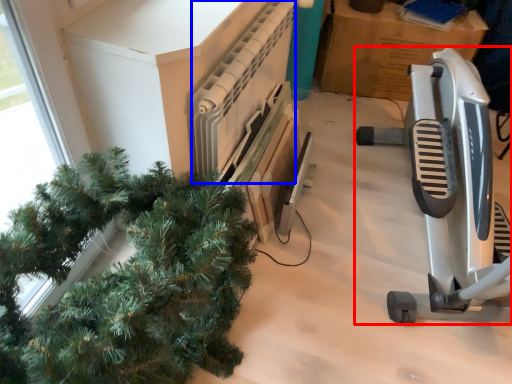
Question: Which of the following is the closest to the observer, job (highlighted by a red box) or radiator (highlighted by a blue box)?

Choices:
 (A) job
 (B) radiator

Answer: (A)